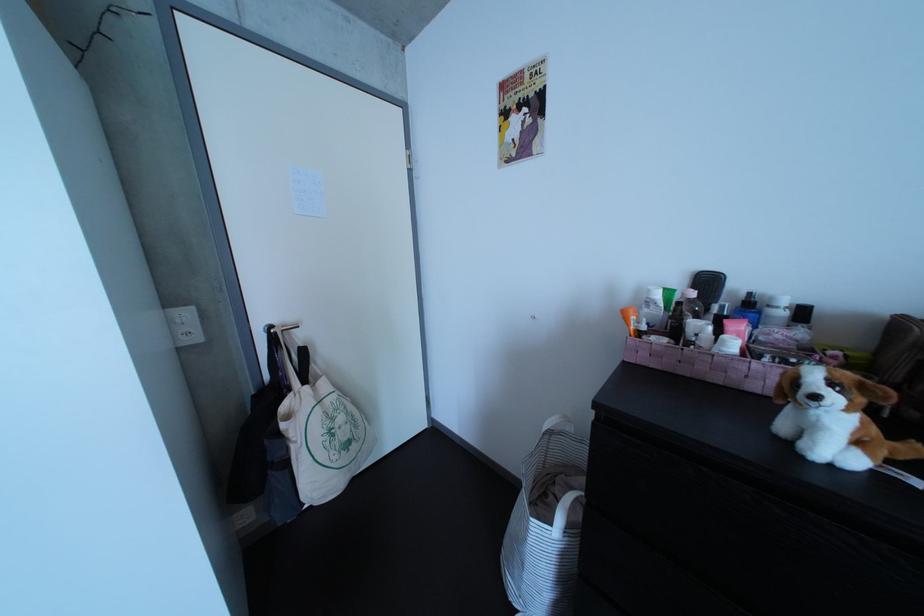
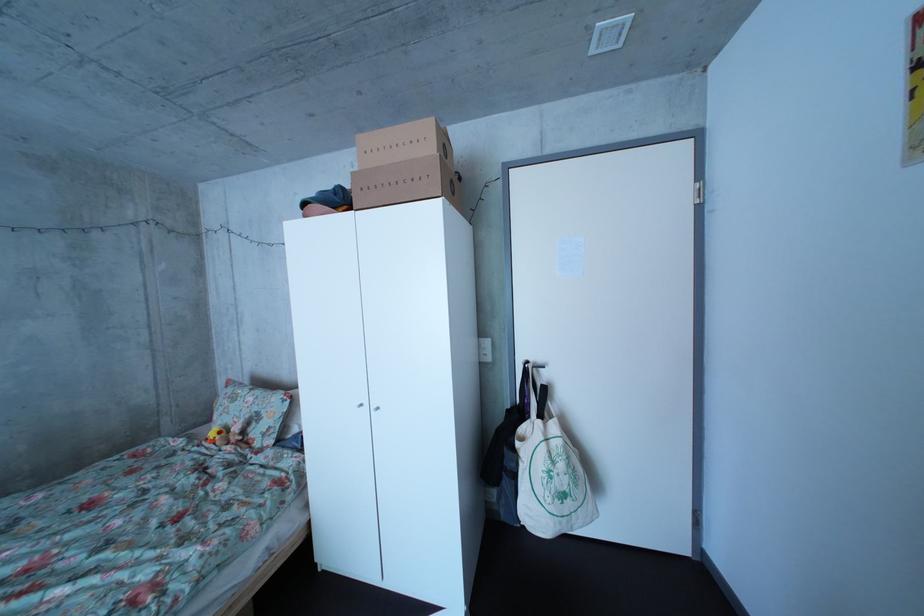
Question: The camera is either moving clockwise (left) or counter-clockwise (right) around the object. The first image is from the beginning of the video and the second image is from the end. Is the camera moving left or right when shooting the video?

Choices:
 (A) Left
 (B) Right

Answer: (B)